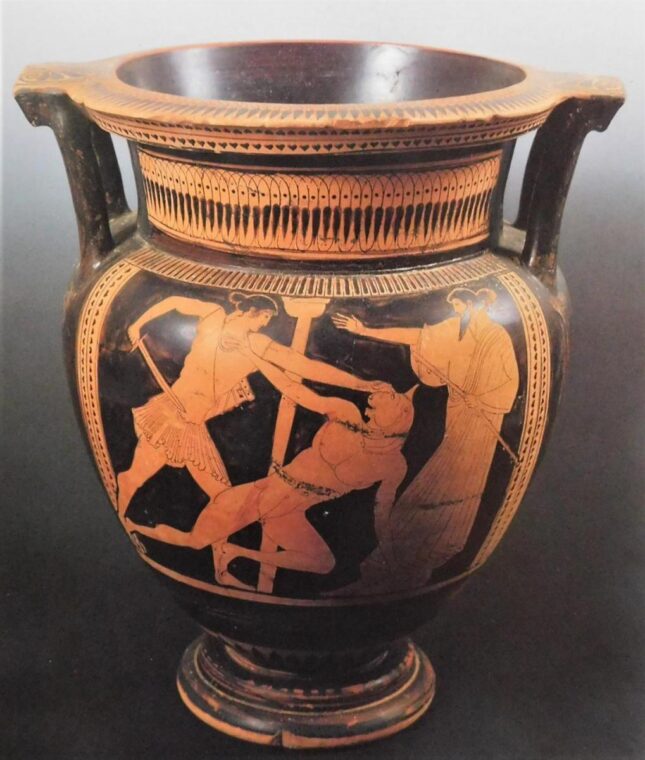
Find the location of a particular element. black pottery is located at coordinates (244, 432).